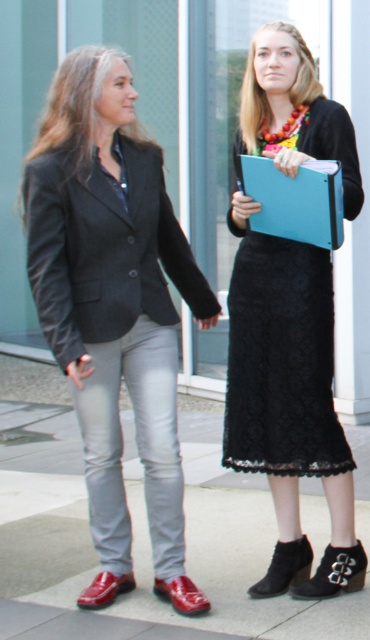
Question: Based on their relative distances, which object is farther from the smooth concrete pavement at center?

Choices:
 (A) black lace skirt at center
 (B) blue matte clipboard at center
 (C) matte black blazer at left

Answer: (B)

Question: Considering the relative positions of smooth concrete pavement at center and blue matte clipboard at center in the image provided, where is smooth concrete pavement at center located with respect to blue matte clipboard at center?

Choices:
 (A) below
 (B) above

Answer: (A)

Question: Where is smooth concrete pavement at center located in relation to black lace skirt at center in the image?

Choices:
 (A) above
 (B) below

Answer: (B)

Question: Which object is the farthest from the smooth concrete pavement at center?

Choices:
 (A) matte black blazer at left
 (B) blue matte clipboard at center
 (C) black lace skirt at center

Answer: (B)

Question: Among these objects, which one is farthest from the camera?

Choices:
 (A) black lace skirt at center
 (B) blue matte clipboard at center

Answer: (A)

Question: Observing the image, what is the correct spatial positioning of black lace skirt at center in reference to blue matte clipboard at center?

Choices:
 (A) above
 (B) below

Answer: (B)